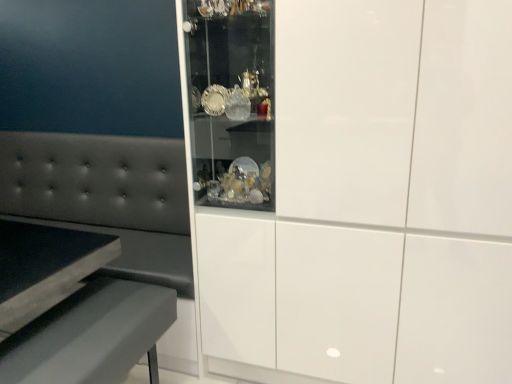
Question: Should I look upward or downward to see matte gray table at lower left?

Choices:
 (A) up
 (B) down

Answer: (B)

Question: From a real-world perspective, is matte gray table at lower left located higher than tufted leather couch at left?

Choices:
 (A) yes
 (B) no

Answer: (B)

Question: From the image's perspective, does matte gray table at lower left appear lower than tufted leather couch at left?

Choices:
 (A) yes
 (B) no

Answer: (A)

Question: Is matte gray table at lower left shorter than tufted leather couch at left?

Choices:
 (A) no
 (B) yes

Answer: (B)

Question: Does matte gray table at lower left have a smaller size compared to tufted leather couch at left?

Choices:
 (A) no
 (B) yes

Answer: (B)

Question: Is tufted leather couch at left at the back of matte gray table at lower left?

Choices:
 (A) no
 (B) yes

Answer: (A)

Question: Is matte gray table at lower left positioned in front of tufted leather couch at left?

Choices:
 (A) no
 (B) yes

Answer: (B)

Question: Does white glossy cabinet at center have a lesser height compared to tufted leather couch at left?

Choices:
 (A) yes
 (B) no

Answer: (B)

Question: Considering the relative sizes of white glossy cabinet at center and tufted leather couch at left in the image provided, is white glossy cabinet at center wider than tufted leather couch at left?

Choices:
 (A) no
 (B) yes

Answer: (B)

Question: Can you confirm if white glossy cabinet at center is bigger than tufted leather couch at left?

Choices:
 (A) yes
 (B) no

Answer: (A)

Question: Does white glossy cabinet at center appear on the right side of tufted leather couch at left?

Choices:
 (A) yes
 (B) no

Answer: (A)

Question: Is the depth of white glossy cabinet at center greater than that of tufted leather couch at left?

Choices:
 (A) yes
 (B) no

Answer: (B)

Question: Can you confirm if white glossy cabinet at center is positioned to the left of tufted leather couch at left?

Choices:
 (A) yes
 (B) no

Answer: (B)

Question: Is matte gray table at lower left at the back of tufted leather couch at left?

Choices:
 (A) yes
 (B) no

Answer: (B)